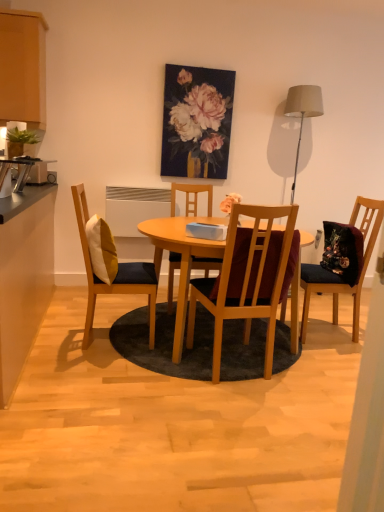
Question: Does matte beige lampshade at upper right have a lesser width compared to black laminate countertop at left, marked as the 2th cabinetry in a top-to-bottom arrangement?

Choices:
 (A) yes
 (B) no

Answer: (A)

Question: Is matte beige lampshade at upper right to the left of black laminate countertop at left, marked as the 2th cabinetry in a top-to-bottom arrangement, from the viewer's perspective?

Choices:
 (A) yes
 (B) no

Answer: (B)

Question: From the image's perspective, is matte beige lampshade at upper right beneath black laminate countertop at left, which is the 1th cabinetry from bottom to top?

Choices:
 (A) yes
 (B) no

Answer: (B)

Question: From a real-world perspective, is matte beige lampshade at upper right beneath black laminate countertop at left, which is the 1th cabinetry from bottom to top?

Choices:
 (A) no
 (B) yes

Answer: (A)

Question: From a real-world perspective, is matte beige lampshade at upper right physically above black laminate countertop at left, which is the 1th cabinetry from bottom to top?

Choices:
 (A) no
 (B) yes

Answer: (B)

Question: From the image's perspective, is matte beige lampshade at upper right located above or below white plastic radiator at center?

Choices:
 (A) above
 (B) below

Answer: (A)

Question: In terms of height, does matte beige lampshade at upper right look taller or shorter compared to white plastic radiator at center?

Choices:
 (A) short
 (B) tall

Answer: (B)

Question: Considering the positions of point (294, 112) and point (122, 202), is point (294, 112) closer or farther from the camera than point (122, 202)?

Choices:
 (A) farther
 (B) closer

Answer: (A)

Question: From a real-world perspective, relative to white plastic radiator at center, is matte beige lampshade at upper right vertically above or below?

Choices:
 (A) below
 (B) above

Answer: (B)

Question: Is black laminate countertop at left, marked as the 2th cabinetry in a top-to-bottom arrangement, situated inside light wood table at center or outside?

Choices:
 (A) inside
 (B) outside

Answer: (B)

Question: Looking at their shapes, would you say black laminate countertop at left, marked as the 2th cabinetry in a top-to-bottom arrangement, is wider or thinner than light wood table at center?

Choices:
 (A) wide
 (B) thin

Answer: (B)

Question: Does point (18, 218) appear closer or farther from the camera than point (86, 267)?

Choices:
 (A) farther
 (B) closer

Answer: (B)

Question: From the image's perspective, is black laminate countertop at left, marked as the 2th cabinetry in a top-to-bottom arrangement, positioned above or below light wood table at center?

Choices:
 (A) above
 (B) below

Answer: (A)

Question: Is white plastic radiator at center inside the boundaries of light wood table at center, or outside?

Choices:
 (A) outside
 (B) inside

Answer: (A)

Question: In terms of height, does white plastic radiator at center look taller or shorter compared to light wood table at center?

Choices:
 (A) tall
 (B) short

Answer: (B)